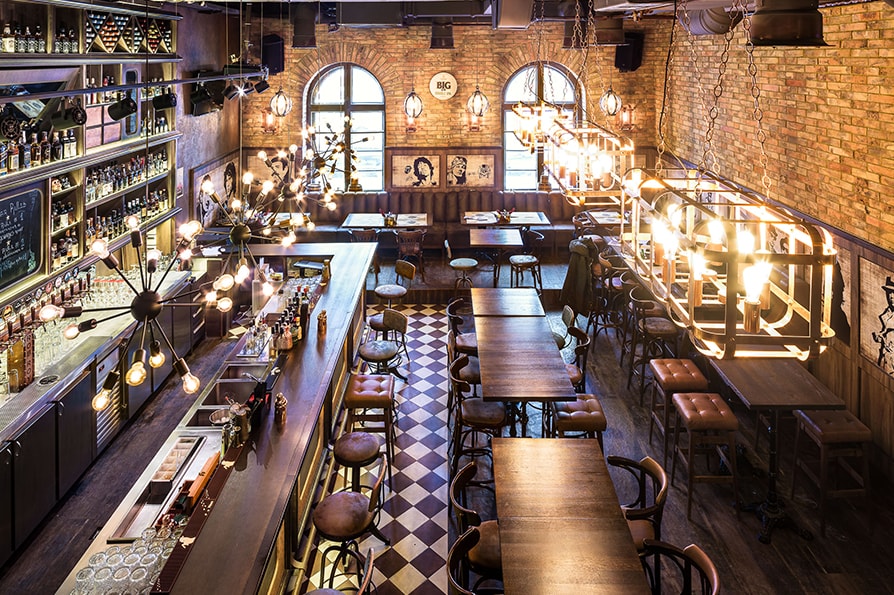
Identify the location of liquor bottles. (x=123, y=173), (x=106, y=220), (x=66, y=246), (x=66, y=209), (x=57, y=144), (x=66, y=36), (x=29, y=33), (x=166, y=198), (x=162, y=162), (x=162, y=119).